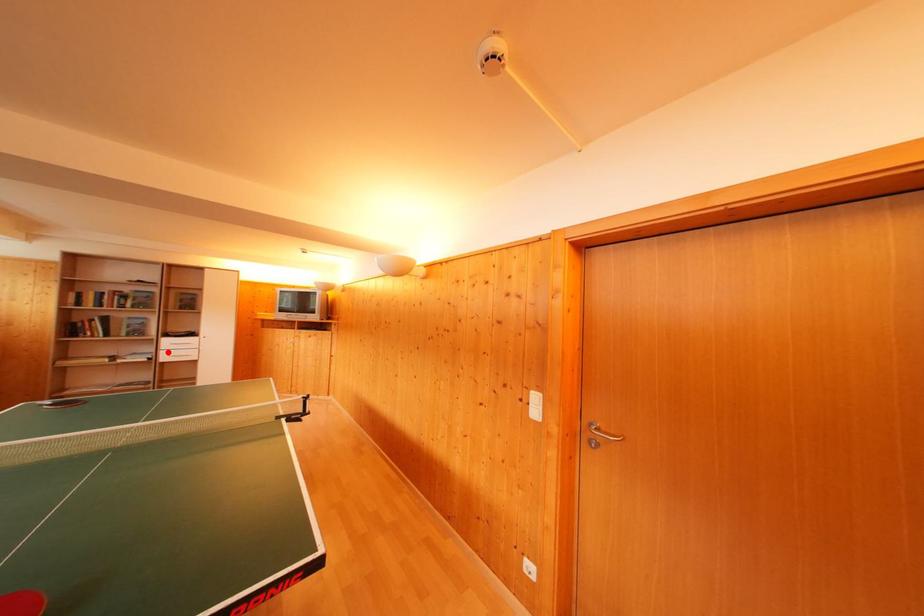
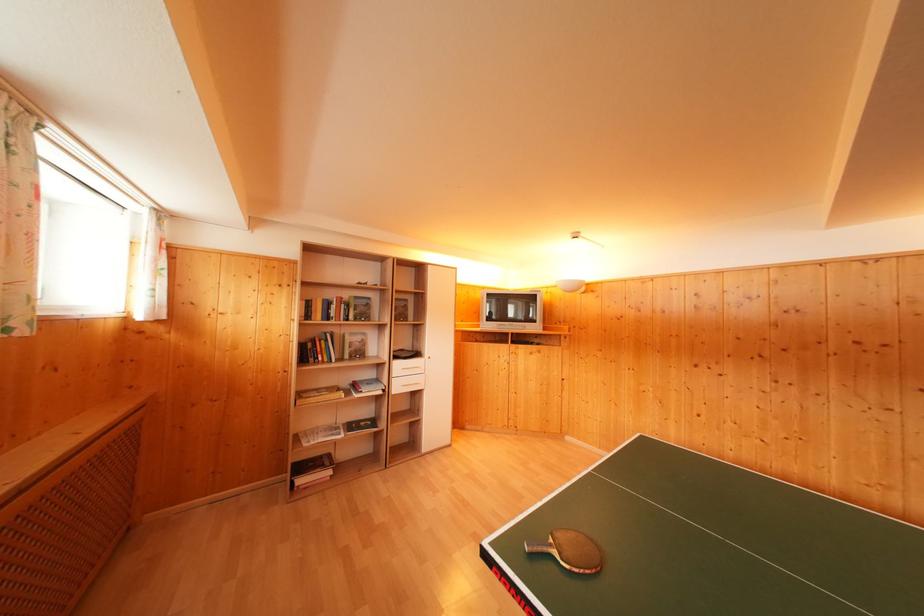
Question: I am providing you with two images of the same scene from different viewpoints. A red point is marked on the first image. Can you still see the location of the red point in image 2?

Choices:
 (A) Yes
 (B) No

Answer: (A)